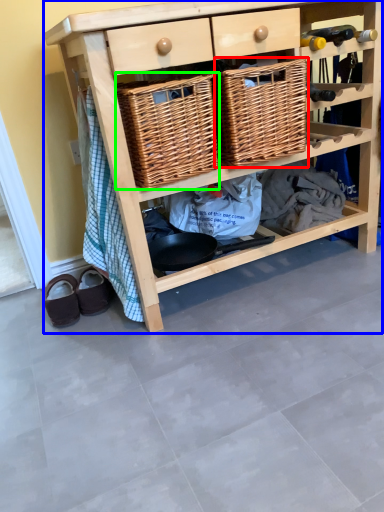
Question: Considering the real-world distances, which object is closest to basket (highlighted by a red box)? shelf (highlighted by a blue box) or basket (highlighted by a green box).

Choices:
 (A) shelf
 (B) basket

Answer: (B)